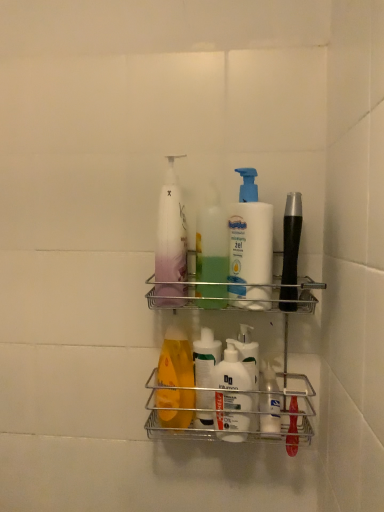
The height and width of the screenshot is (512, 384). I want to click on blank space situated above metallic silver shelf at center (from a real-world perspective), so coord(233,249).